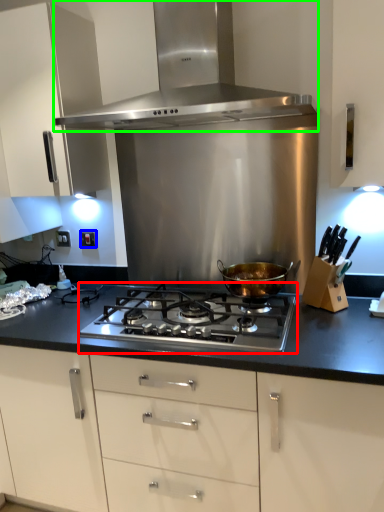
Question: Which object is the farthest from gas stove (highlighted by a red box)? Choose among these: electric outlet (highlighted by a blue box) or kitchen appliance (highlighted by a green box).

Choices:
 (A) electric outlet
 (B) kitchen appliance

Answer: (A)